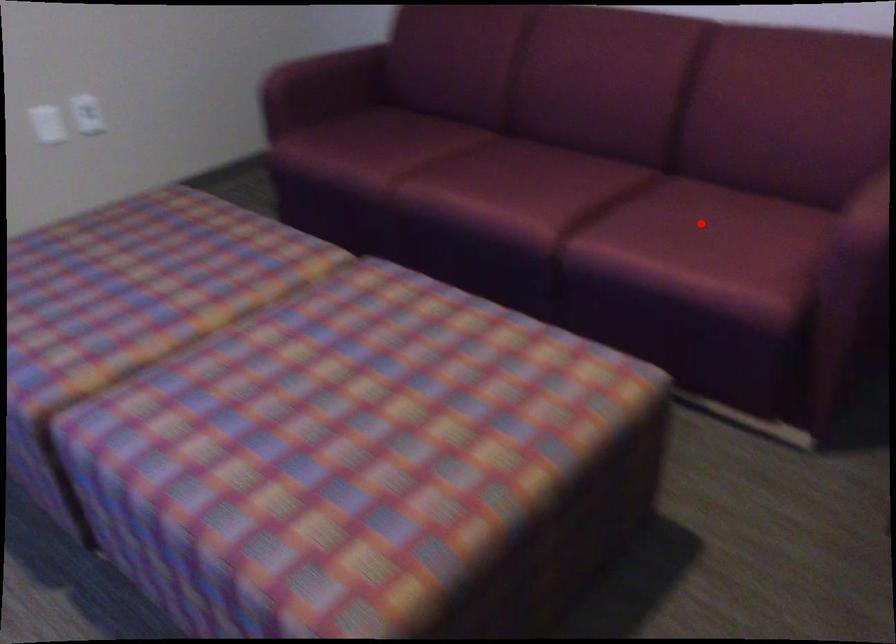
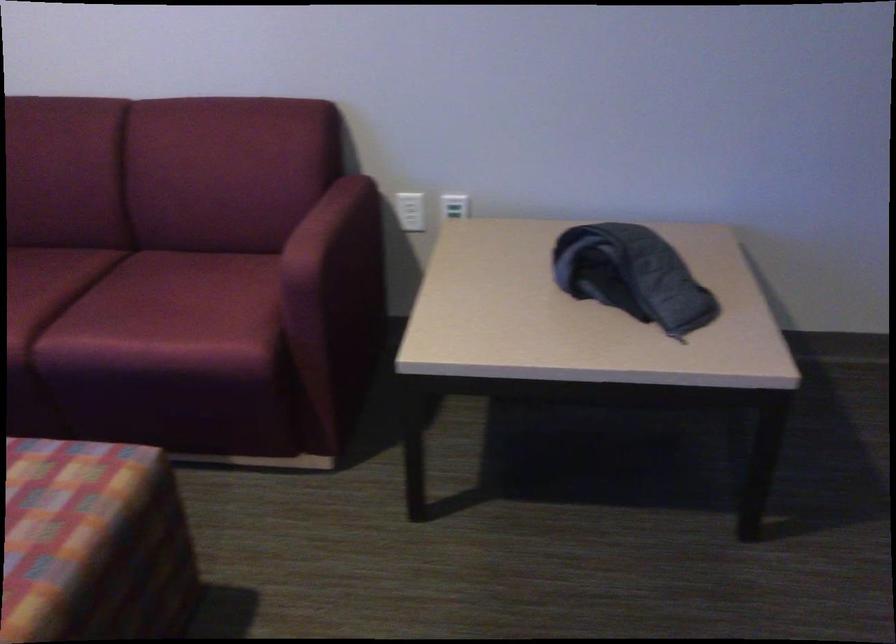
The point at the highlighted location is marked in the first image. Where is the corresponding point in the second image?

(175, 290)